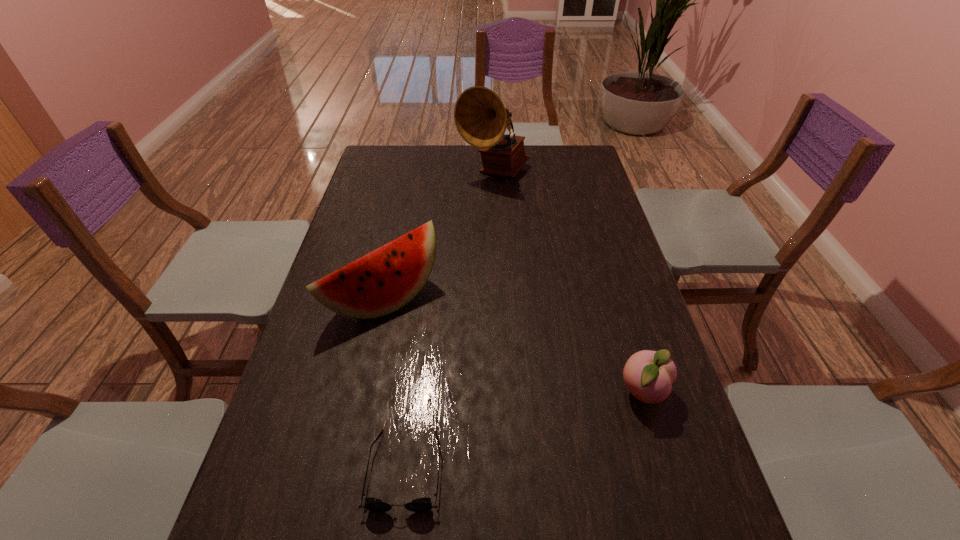
In the image, there is a desktop. What are the coordinates of `free space at the near edge` in the screenshot? It's located at (505, 485).

At what (x,y) coordinates should I click in order to perform the action: click on free space at the left edge of the desktop. Please return your answer as a coordinate pair (x, y). This screenshot has height=540, width=960. Looking at the image, I should click on (395, 215).

The width and height of the screenshot is (960, 540). What are the coordinates of `free space at the right edge of the desktop` in the screenshot? It's located at (580, 241).

Locate an element on the screen. blank space at the far right corner of the desktop is located at coordinates (552, 146).

Locate an element on the screen. free point at the near right corner is located at coordinates (708, 494).

Locate an element on the screen. unoccupied area between the second nearest object and the tallest object is located at coordinates (568, 283).

At what (x,y) coordinates should I click in order to perform the action: click on free spot between the third tallest object and the sunglasses. Please return your answer as a coordinate pair (x, y). Image resolution: width=960 pixels, height=540 pixels. Looking at the image, I should click on (524, 431).

The height and width of the screenshot is (540, 960). Find the location of `vacant space that's between the rightmost object and the tallest object`. vacant space that's between the rightmost object and the tallest object is located at coordinates (568, 283).

Locate an element on the screen. empty location between the nearest object and the farthest object is located at coordinates pyautogui.click(x=449, y=321).

You are a GUI agent. You are given a task and a screenshot of the screen. Output one action in this format:
    pyautogui.click(x=<x>, y=<y>)
    Task: Click on the unoccupied position between the sunglasses and the farthest object
    The height and width of the screenshot is (540, 960).
    Given the screenshot: What is the action you would take?
    pyautogui.click(x=449, y=321)